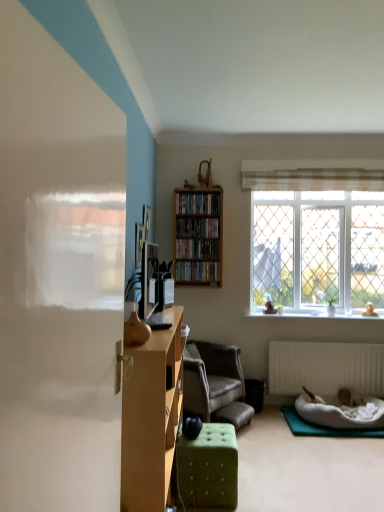
You are a GUI agent. You are given a task and a screenshot of the screen. Output one action in this format:
    pyautogui.click(x=<x>, y=<y>)
    Task: Click on the empty space that is ontop of white plastic radiator at lower right (from a real-world perspective)
    The height and width of the screenshot is (512, 384).
    Given the screenshot: What is the action you would take?
    pyautogui.click(x=344, y=339)